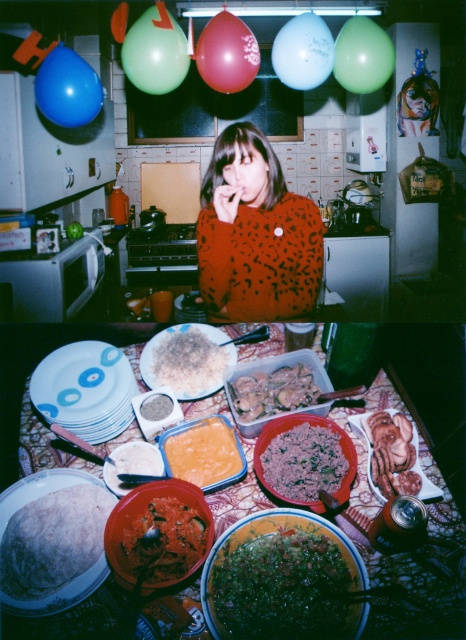
Question: Estimate the real-world distances between objects in this image. Which object is closer to the leopard print sweater at center?

Choices:
 (A) white rice at center
 (B) white glossy plate at center

Answer: (A)

Question: Which of the following is the farthest from the observer?

Choices:
 (A) plastic container at center
 (B) green matte balloon at upper right
 (C) orange gelatinous substance at center

Answer: (B)

Question: Is orange gelatinous substance at center to the left of red rubber balloon at upper center from the viewer's perspective?

Choices:
 (A) yes
 (B) no

Answer: (B)

Question: Which of these objects is positioned farthest from the white rice at center?

Choices:
 (A) orange gelatinous substance at center
 (B) green matte balloon at upper left
 (C) blue rubber balloon at upper left

Answer: (C)

Question: Observing the image, what is the correct spatial positioning of dark red glossy sauce at center in reference to light blue rubber balloon at upper center?

Choices:
 (A) right
 (B) left

Answer: (B)

Question: Observing the image, what is the correct spatial positioning of plastic container at center in reference to slightly pinkish glossy meat at center?

Choices:
 (A) above
 (B) below

Answer: (B)